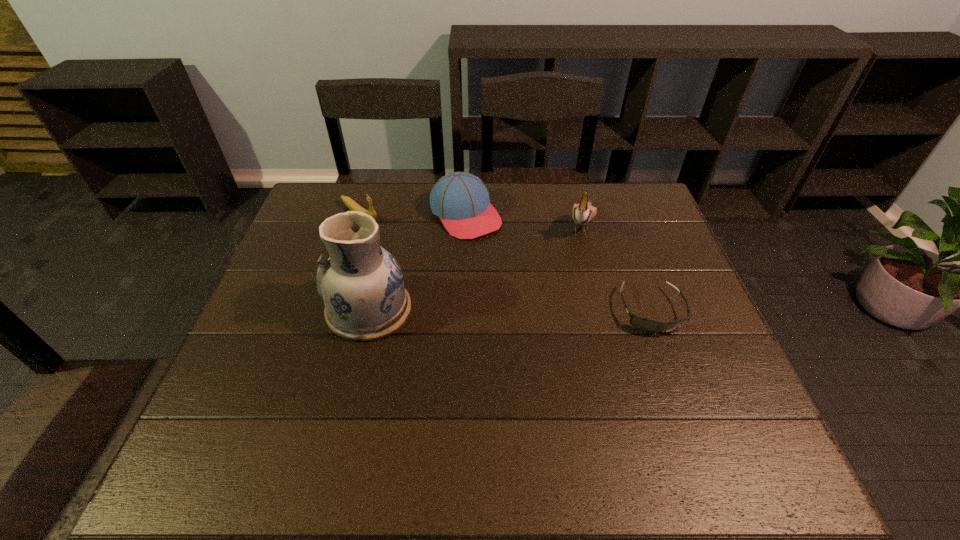
This screenshot has width=960, height=540. Find the location of `vacant space that is in between the shortest object and the second tallest object`. vacant space that is in between the shortest object and the second tallest object is located at coordinates (616, 267).

I want to click on unoccupied position between the fourth shortest object and the third object from right to left, so click(x=523, y=219).

Where is `free space between the baseball cap and the bird`? This screenshot has height=540, width=960. free space between the baseball cap and the bird is located at coordinates (523, 219).

I want to click on vacant region between the third object from right to left and the tallest object, so click(x=418, y=262).

Locate an element on the screen. empty space between the banana and the baseball cap is located at coordinates [x=413, y=214].

You are a GUI agent. You are given a task and a screenshot of the screen. Output one action in this format:
    pyautogui.click(x=<x>, y=<y>)
    Task: Click on the vacant point located between the bird and the shortest object
    
    Given the screenshot: What is the action you would take?
    pyautogui.click(x=616, y=267)

Locate which object ranks fourth in proximity to the shortest object. Please provide its 2D coordinates. Your answer should be formatted as a tuple, i.e. [(x, y)], where the tuple contains the x and y coordinates of a point satisfying the conditions above.

[(350, 203)]

Image resolution: width=960 pixels, height=540 pixels. In order to click on the third closest object to the pottery in this screenshot , I will do `click(583, 213)`.

Where is `vacant point that satisfies the following two spatial constraints: 1. on the front side of the bird; 2. on the left side of the banana`? This screenshot has width=960, height=540. vacant point that satisfies the following two spatial constraints: 1. on the front side of the bird; 2. on the left side of the banana is located at coordinates (356, 224).

Locate an element on the screen. The image size is (960, 540). free location that satisfies the following two spatial constraints: 1. on the front side of the baseball cap; 2. on the left side of the bird is located at coordinates (466, 224).